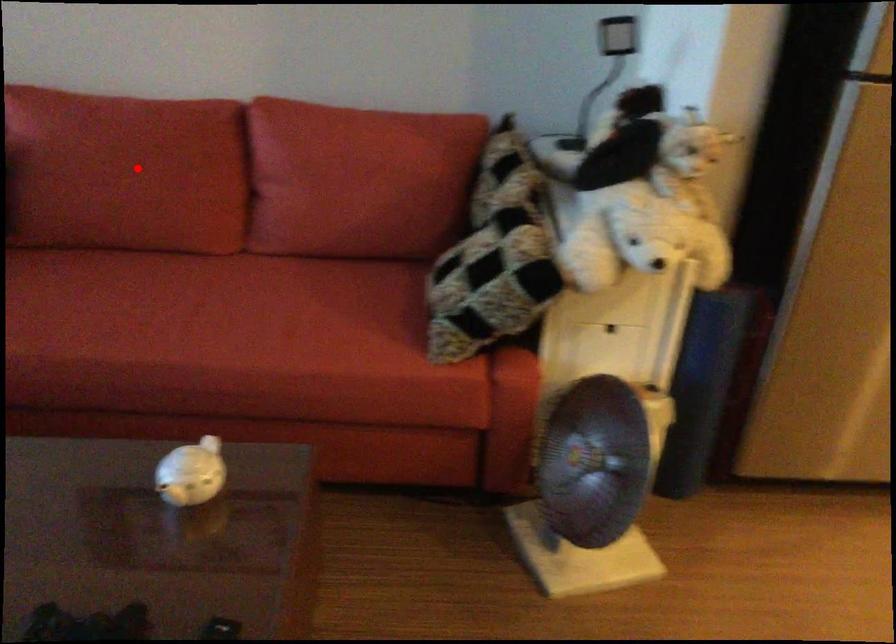
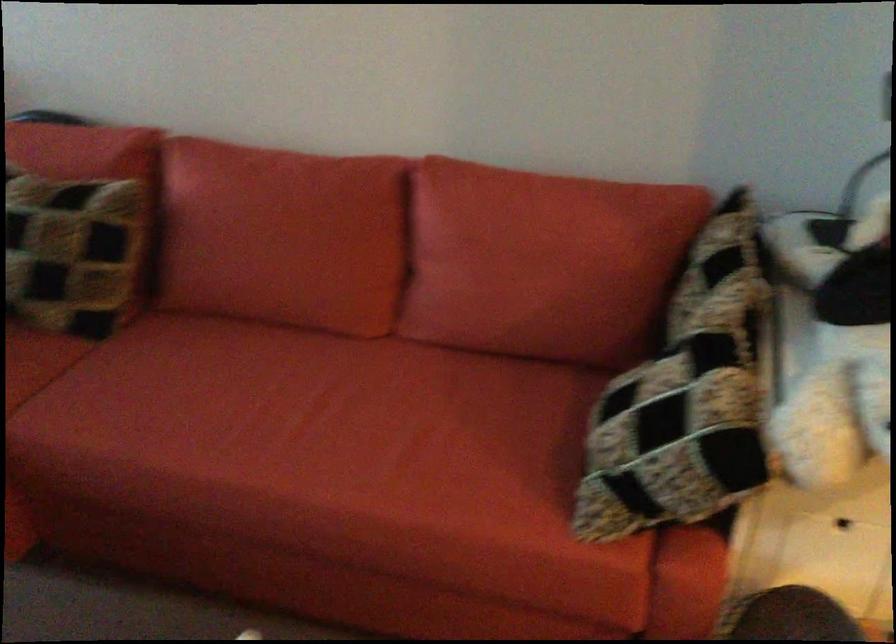
Where in the second image is the point corresponding to the highlighted location from the first image?

(282, 236)